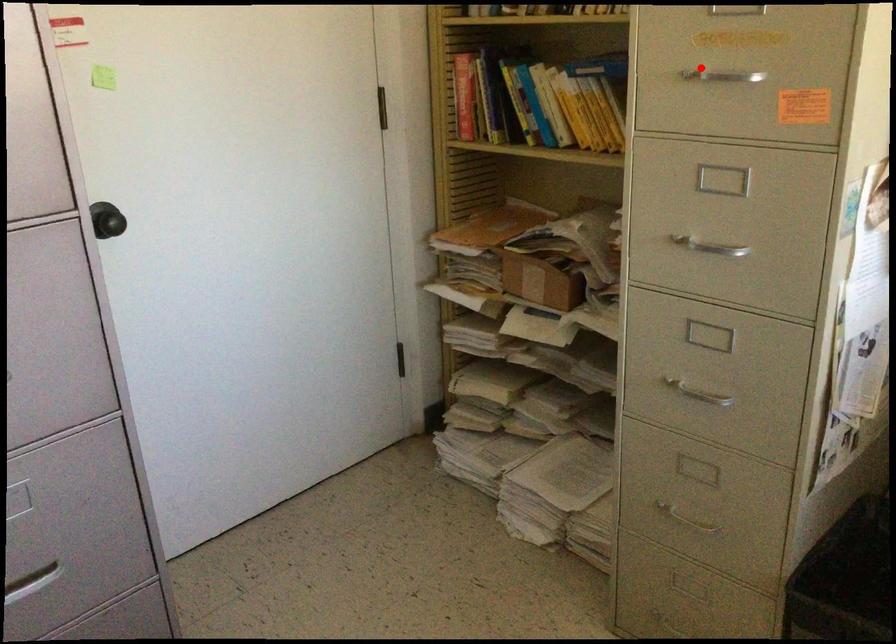
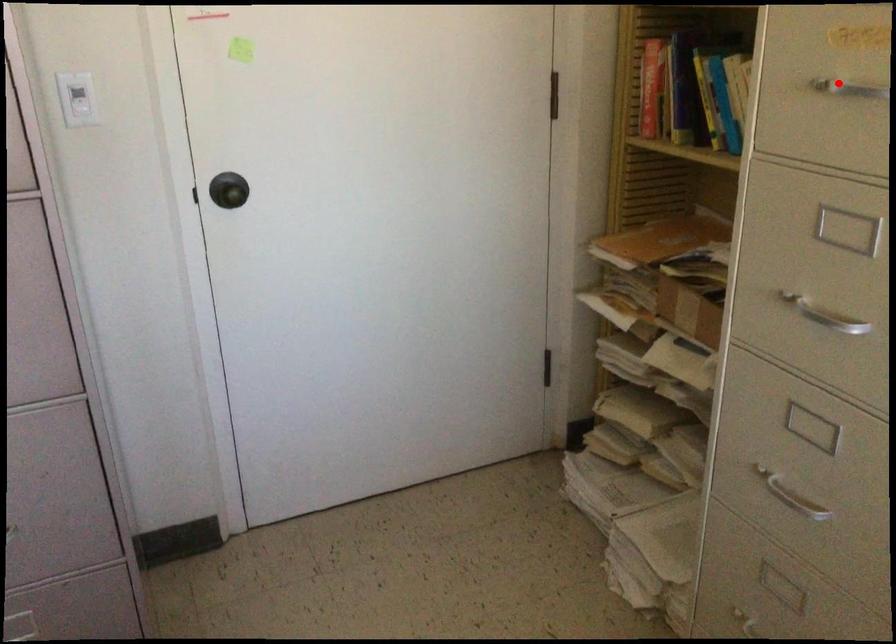
I am providing you with two images of the same scene from different viewpoints. A red point is marked on the first image and another point is marked on the second image. Do the highlighted points in image1 and image2 indicate the same real-world spot?

Yes